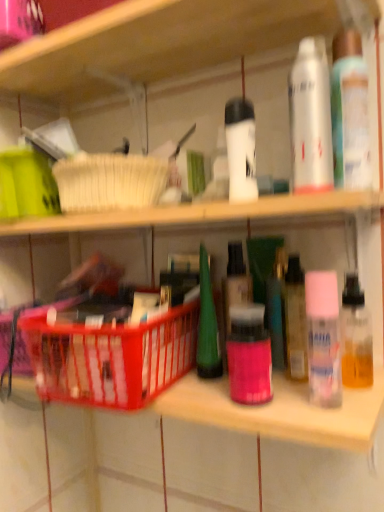
Question: Is white matte spray can at upper right far away from translucent plastic spray can at upper right, which is the fourth toiletry in bottom-to-top order?

Choices:
 (A) yes
 (B) no

Answer: (B)

Question: Can you confirm if white matte spray can at upper right is positioned to the right of translucent plastic spray can at upper right, placed as the 1th toiletry when sorted from top to bottom?

Choices:
 (A) no
 (B) yes

Answer: (A)

Question: Considering the relative sizes of white matte spray can at upper right and translucent plastic spray can at upper right, which is the fourth toiletry in bottom-to-top order, in the image provided, is white matte spray can at upper right shorter than translucent plastic spray can at upper right, which is the fourth toiletry in bottom-to-top order,?

Choices:
 (A) no
 (B) yes

Answer: (B)

Question: Is white matte spray can at upper right turned away from translucent plastic spray can at upper right, which is the fourth toiletry in bottom-to-top order?

Choices:
 (A) no
 (B) yes

Answer: (A)

Question: Can you confirm if white matte spray can at upper right is taller than translucent plastic spray can at upper right, placed as the 1th toiletry when sorted from top to bottom?

Choices:
 (A) yes
 (B) no

Answer: (B)

Question: From the image's perspective, is white matte spray can at upper right below translucent plastic spray can at upper right, which is the fourth toiletry in bottom-to-top order?

Choices:
 (A) yes
 (B) no

Answer: (A)

Question: Can you confirm if pink matte spray can at right, acting as the 3th toiletry starting from the top, is smaller than translucent plastic spray can at upper right, which is the fourth toiletry in bottom-to-top order?

Choices:
 (A) yes
 (B) no

Answer: (A)

Question: Does pink matte spray can at right, acting as the 2th toiletry starting from the bottom, appear on the right side of translucent plastic spray can at upper right, which is the fourth toiletry in bottom-to-top order?

Choices:
 (A) yes
 (B) no

Answer: (B)

Question: Is pink matte spray can at right, acting as the 2th toiletry starting from the bottom, facing towards translucent plastic spray can at upper right, placed as the 1th toiletry when sorted from top to bottom?

Choices:
 (A) no
 (B) yes

Answer: (A)

Question: Is translucent plastic spray can at upper right, placed as the 1th toiletry when sorted from top to bottom, inside pink matte spray can at right, acting as the 3th toiletry starting from the top?

Choices:
 (A) no
 (B) yes

Answer: (A)

Question: Considering the relative positions of pink matte spray can at right, acting as the 2th toiletry starting from the bottom, and translucent plastic spray can at upper right, which is the fourth toiletry in bottom-to-top order, in the image provided, is pink matte spray can at right, acting as the 2th toiletry starting from the bottom, behind translucent plastic spray can at upper right, which is the fourth toiletry in bottom-to-top order,?

Choices:
 (A) yes
 (B) no

Answer: (B)

Question: Would you consider pink matte spray can at right, acting as the 3th toiletry starting from the top, to be distant from translucent plastic spray can at upper right, which is the fourth toiletry in bottom-to-top order?

Choices:
 (A) yes
 (B) no

Answer: (B)

Question: Is pink matte bottle at center, arranged as the 1th toiletry when ordered from the bottom, not inside translucent plastic basket at center?

Choices:
 (A) yes
 (B) no

Answer: (A)